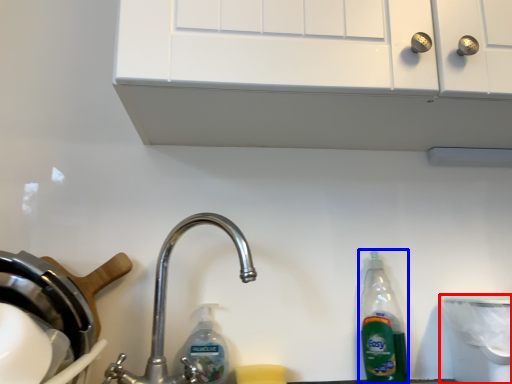
Question: Among these objects, which one is farthest to the camera, appliance (highlighted by a red box) or bottle (highlighted by a blue box)?

Choices:
 (A) appliance
 (B) bottle

Answer: (B)